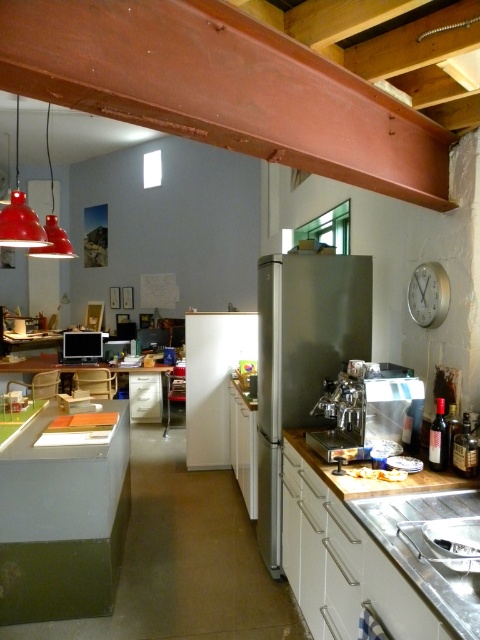
You are a delivery person standing at the entrance of the kitchen. You need to place a package on a surface that is exactly 2.44 meters away from you. Can you use the silver metallic clock at upper right for this task?

The silver metallic clock at upper right is 2.44 meters away from the viewer, so yes, you can place the package on the silver metallic clock at upper right since it is exactly the required distance.

Based on the photo, you are a delivery person trying to place a package between the silver metallic clock at upper right and the matte red pendant light at upper left. The package is 8 feet long. Will it fit between them?

Result: The distance between the silver metallic clock at upper right and the matte red pendant light at upper left is 7.98 feet, which is slightly shorter than the 8 feet long package. Therefore, the package will not fit between them.

You are planning to move a large appliance into the kitchen. The space currently has the stainless steel refrigerator at center and the matte red pendant light at upper left. Which object takes up more space in the kitchen?

The stainless steel refrigerator at center takes up more space in the kitchen because it is bigger than the matte red pendant light at upper left.